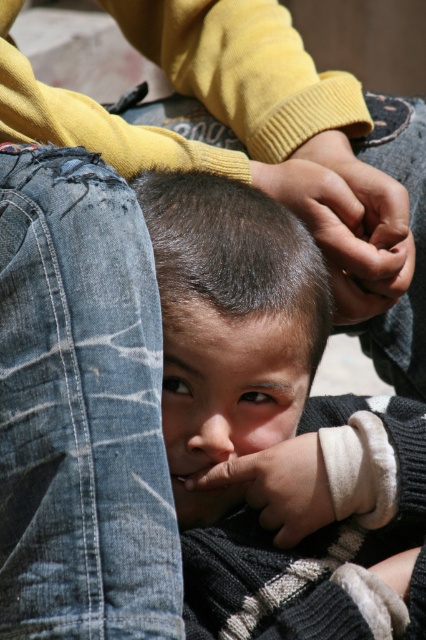
Based on the scene description, which object is positioned higher on the child? The dark brown hair at center or the smooth skin forehead at center?

The dark brown hair at center is located above the smooth skin forehead at center, so the dark brown hair at center is positioned higher on the child.

You are a photographer adjusting the focus on your camera. You want to ensure that both the smooth skin child at center and the smooth skin forehead at center are in focus. Given their positions, which part should you focus on first to achieve this?

The smooth skin child at center is closer to the viewer than the smooth skin forehead at center. To ensure both are in focus, focus on the smooth skin child at center first, as it is closer, and the forehead will naturally come into focus as it is further back.